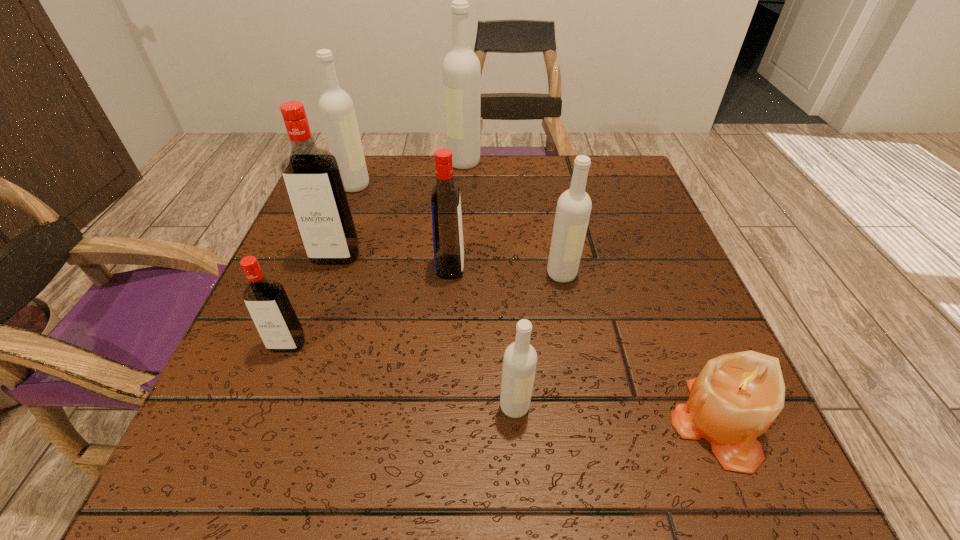
Locate an element on the screen. the sixth object from left to right is located at coordinates (520, 358).

Find the location of a particular element. This screenshot has height=540, width=960. the nearest vodka is located at coordinates (520, 358).

The image size is (960, 540). I want to click on candle, so click(x=736, y=397).

This screenshot has width=960, height=540. In order to click on the shortest object in this screenshot , I will do `click(736, 397)`.

The height and width of the screenshot is (540, 960). Identify the location of free space located 0.340m on the front of the third white vodka from right to left. (459, 264).

At what (x,y) coordinates should I click in order to perform the action: click on free space located on the right of the second biggest white vodka. Please return your answer as a coordinate pair (x, y). The width and height of the screenshot is (960, 540). Looking at the image, I should click on (535, 186).

Where is `vacant space located 0.090m on the front and back of the biggest red vodka`? vacant space located 0.090m on the front and back of the biggest red vodka is located at coordinates (319, 302).

What are the coordinates of `vacant area situated on the back of the rightmost vodka` in the screenshot? It's located at (541, 165).

Locate an element on the screen. Image resolution: width=960 pixels, height=540 pixels. vacant space located on the front and back of the rightmost red vodka is located at coordinates (512, 267).

You are a GUI agent. You are given a task and a screenshot of the screen. Output one action in this format:
    pyautogui.click(x=<x>, y=<y>)
    Task: Click on the vacant space located 0.140m on the front and back of the sixth farthest vodka
    This screenshot has width=960, height=540.
    Given the screenshot: What is the action you would take?
    pyautogui.click(x=251, y=440)